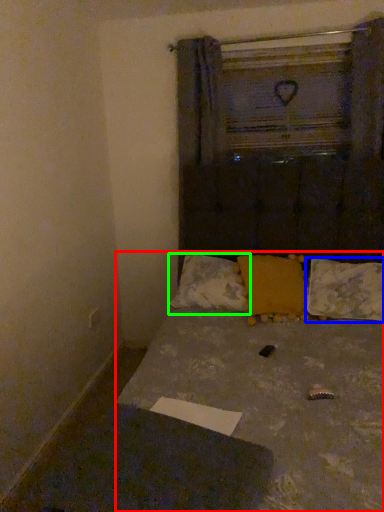
Question: Considering the real-world distances, which object is closest to bed (highlighted by a red box)? pillow (highlighted by a blue box) or pillow (highlighted by a green box).

Choices:
 (A) pillow
 (B) pillow

Answer: (B)